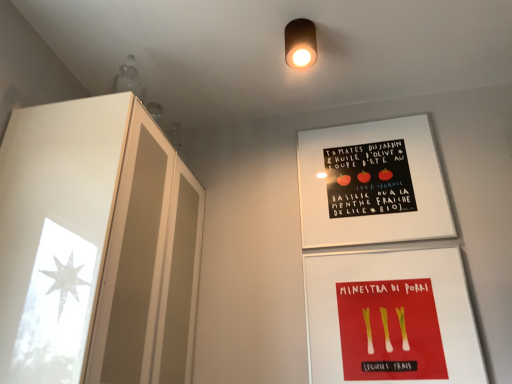
Question: From the image's perspective, is matte brown cylinder at upper center located beneath white matte poster at upper center?

Choices:
 (A) yes
 (B) no

Answer: (B)

Question: Is matte brown cylinder at upper center beside white matte poster at upper center?

Choices:
 (A) yes
 (B) no

Answer: (B)

Question: Considering the relative sizes of matte brown cylinder at upper center and white matte poster at upper center in the image provided, is matte brown cylinder at upper center bigger than white matte poster at upper center?

Choices:
 (A) no
 (B) yes

Answer: (A)

Question: Is matte brown cylinder at upper center wider than white matte poster at upper center?

Choices:
 (A) yes
 (B) no

Answer: (A)

Question: Would you say white matte poster at upper center is part of matte brown cylinder at upper center's contents?

Choices:
 (A) no
 (B) yes

Answer: (A)

Question: From a real-world perspective, is white matte poster at upper center positioned above or below red matte leeks at lower center?

Choices:
 (A) below
 (B) above

Answer: (B)

Question: Considering the positions of white matte poster at upper center and red matte leeks at lower center in the image, is white matte poster at upper center wider or thinner than red matte leeks at lower center?

Choices:
 (A) thin
 (B) wide

Answer: (A)

Question: From their relative heights in the image, would you say white matte poster at upper center is taller or shorter than red matte leeks at lower center?

Choices:
 (A) short
 (B) tall

Answer: (B)

Question: Based on their sizes in the image, would you say white matte poster at upper center is bigger or smaller than red matte leeks at lower center?

Choices:
 (A) big
 (B) small

Answer: (A)

Question: In terms of size, does red matte leeks at lower center appear bigger or smaller than matte brown cylinder at upper center?

Choices:
 (A) big
 (B) small

Answer: (A)

Question: Visually, is red matte leeks at lower center positioned to the left or to the right of matte brown cylinder at upper center?

Choices:
 (A) left
 (B) right

Answer: (B)

Question: Is red matte leeks at lower center wider or thinner than matte brown cylinder at upper center?

Choices:
 (A) wide
 (B) thin

Answer: (B)

Question: From a real-world perspective, relative to matte brown cylinder at upper center, is red matte leeks at lower center vertically above or below?

Choices:
 (A) below
 (B) above

Answer: (A)

Question: Visually, is matte brown cylinder at upper center positioned to the left or to the right of white matte poster at upper center?

Choices:
 (A) left
 (B) right

Answer: (A)

Question: Choose the correct answer: Is matte brown cylinder at upper center inside white matte poster at upper center or outside it?

Choices:
 (A) outside
 (B) inside

Answer: (A)